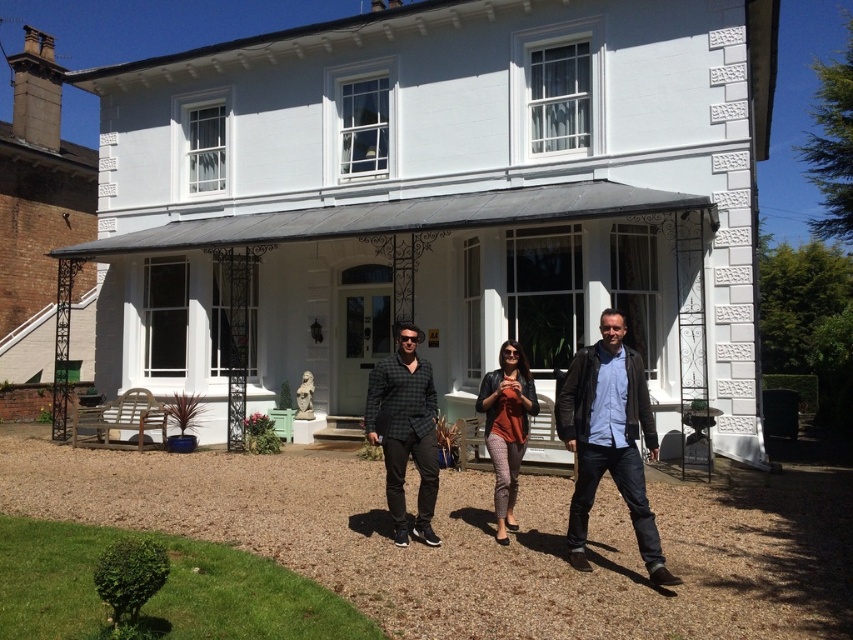
You are standing at the front door of the two story white house with a classic architectural style. You want to place a new decorative item on the gravel driveway where the leather jacket at center is currently located. Is the location at point (608,440) suitable for placing the decorative item?

The location at point (608,440) is currently occupied by the leather jacket at center, so you cannot place the decorative item there until the leather jacket at center is moved.

You are a photographer trying to capture a clear shot of both the leather jacket at center and the matte orange top at center. Based on their positions, which one might be partially obscured in the photo?

The matte orange top at center might be partially obscured because the leather jacket at center is in front of it.

You are standing at the front door of the two story white house and want to greet the person wearing the checkered fabric shirt at center. In which direction should you walk to reach them?

The checkered fabric shirt at center is located at point 0.673 on the x axis and 0.476 on the y axis. Since the coordinates are relative to the image, moving towards the right and forward would lead you to the checkered fabric shirt at center.